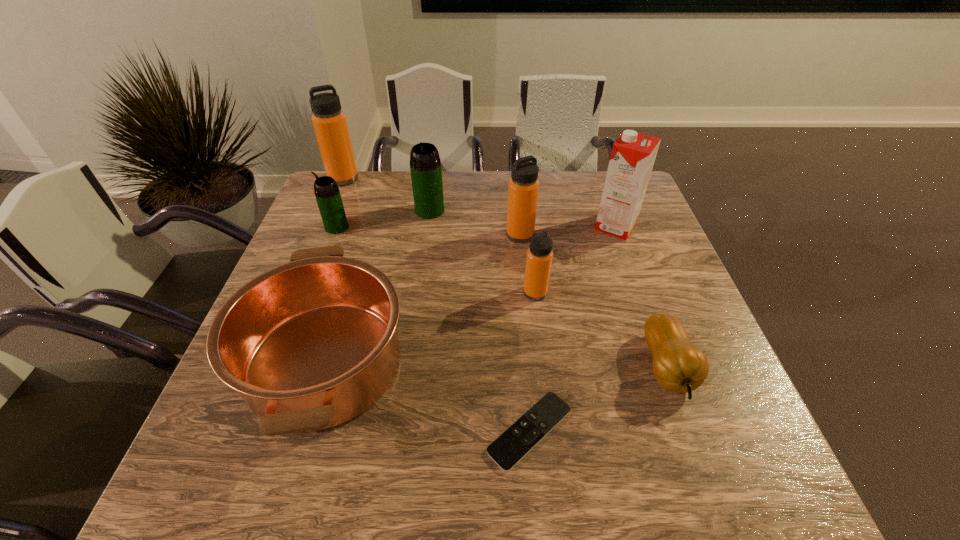
This screenshot has width=960, height=540. I want to click on vacant space located on the stem side of the eighth tallest object, so click(x=704, y=470).

Identify the location of free space located on the back of the black remote control. The width and height of the screenshot is (960, 540). (524, 365).

Identify the location of carton that is at the far edge. (633, 154).

Identify the location of saucepan that is at the near edge. (311, 344).

In order to click on remote control positioned at the near edge in this screenshot , I will do `click(510, 447)`.

Locate an element on the screen. The image size is (960, 540). saucepan that is positioned at the left edge is located at coordinates (311, 344).

Where is `carton located at the right edge`? The width and height of the screenshot is (960, 540). carton located at the right edge is located at coordinates (x=633, y=154).

Where is `gourd that is at the right edge`? This screenshot has height=540, width=960. gourd that is at the right edge is located at coordinates (680, 367).

The height and width of the screenshot is (540, 960). Find the location of `object that is at the far left corner`. object that is at the far left corner is located at coordinates (329, 121).

You are a GUI agent. You are given a task and a screenshot of the screen. Output one action in this format:
    pyautogui.click(x=<x>, y=<y>)
    Task: Click on the object present at the near left corner
    
    Given the screenshot: What is the action you would take?
    pyautogui.click(x=311, y=344)